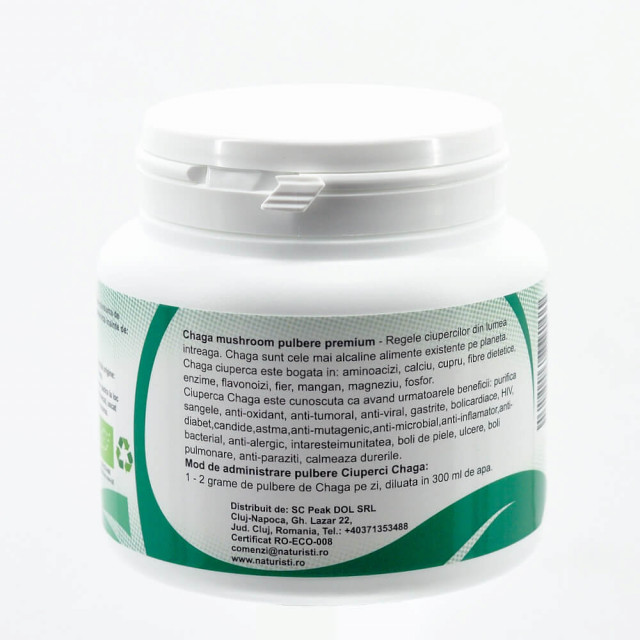
Find the location of a particular element. bottle is located at coordinates (474, 271).